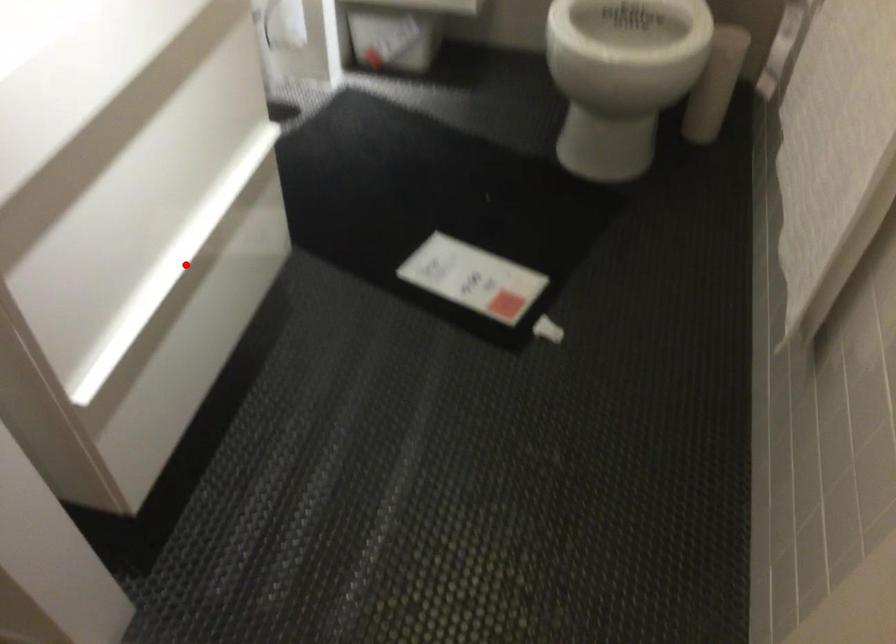
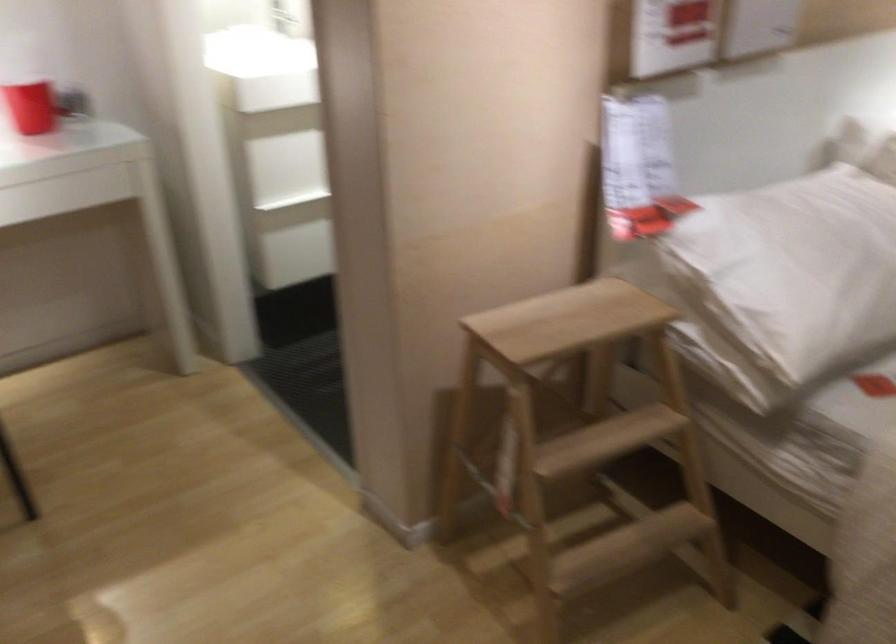
Question: I am providing you with two images of the same scene from different viewpoints. A red point is marked on the first image. Can you still see the location of the red point in image 2?

Choices:
 (A) Yes
 (B) No

Answer: (B)